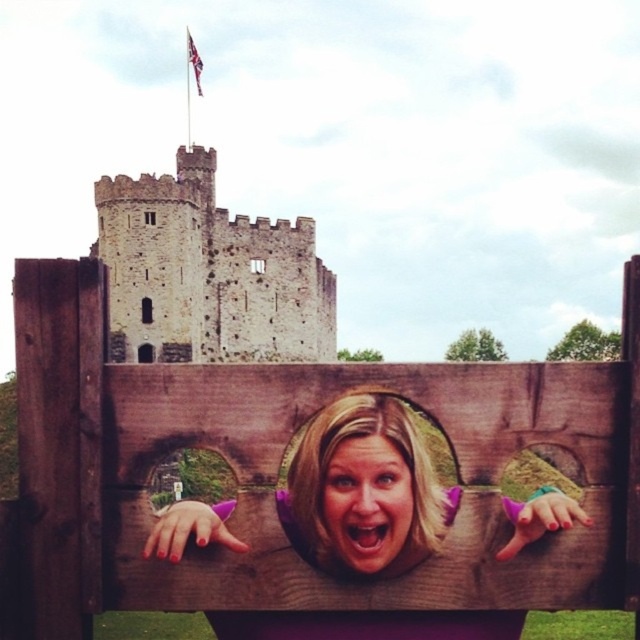
Question: Which object appears closest to the camera in this image?

Choices:
 (A) smooth blonde hair at center
 (B) smooth skin face at center
 (C) stone medieval tower at upper left

Answer: (A)

Question: Which of the following is the farthest from the observer?

Choices:
 (A) (x=188, y=179)
 (B) (x=340, y=496)
 (C) (x=394, y=497)

Answer: (A)

Question: Is stone medieval tower at upper left thinner than smooth blonde hair at center?

Choices:
 (A) no
 (B) yes

Answer: (A)

Question: Considering the real-world distances, which object is farthest from the stone medieval tower at upper left?

Choices:
 (A) smooth blonde hair at center
 (B) smooth skin face at center

Answer: (B)

Question: Does stone medieval tower at upper left lie behind smooth skin face at center?

Choices:
 (A) yes
 (B) no

Answer: (B)

Question: Can you confirm if stone medieval tower at upper left is positioned to the right of smooth blonde hair at center?

Choices:
 (A) no
 (B) yes

Answer: (A)